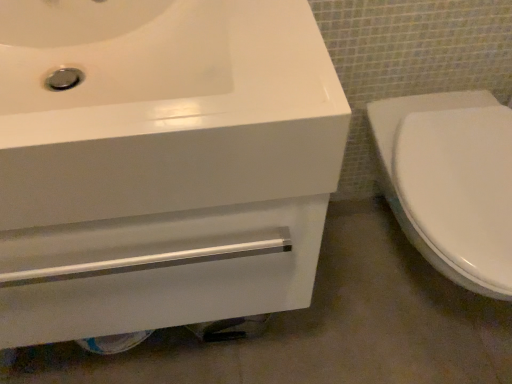
Question: From the image's perspective, is white glossy sink at upper left located above white glossy drawer at lower left?

Choices:
 (A) no
 (B) yes

Answer: (B)

Question: Does white glossy sink at upper left touch white glossy drawer at lower left?

Choices:
 (A) yes
 (B) no

Answer: (A)

Question: Can you confirm if white glossy sink at upper left is wider than white glossy drawer at lower left?

Choices:
 (A) no
 (B) yes

Answer: (A)

Question: Does white glossy sink at upper left have a greater height compared to white glossy drawer at lower left?

Choices:
 (A) yes
 (B) no

Answer: (A)

Question: Does white glossy sink at upper left appear on the left side of white glossy drawer at lower left?

Choices:
 (A) no
 (B) yes

Answer: (B)

Question: Can you confirm if white glossy sink at upper left is bigger than white glossy drawer at lower left?

Choices:
 (A) yes
 (B) no

Answer: (A)

Question: Considering the relative sizes of white glossy drawer at lower left and white glossy sink at upper left in the image provided, is white glossy drawer at lower left thinner than white glossy sink at upper left?

Choices:
 (A) yes
 (B) no

Answer: (B)

Question: Does white glossy drawer at lower left touch white glossy sink at upper left?

Choices:
 (A) yes
 (B) no

Answer: (A)

Question: From a real-world perspective, is white glossy drawer at lower left positioned under white glossy sink at upper left based on gravity?

Choices:
 (A) yes
 (B) no

Answer: (A)

Question: Is white glossy drawer at lower left positioned with its back to white glossy sink at upper left?

Choices:
 (A) no
 (B) yes

Answer: (A)

Question: Does white glossy drawer at lower left lie behind white glossy sink at upper left?

Choices:
 (A) no
 (B) yes

Answer: (B)

Question: Does white glossy drawer at lower left have a lesser height compared to white glossy sink at upper left?

Choices:
 (A) yes
 (B) no

Answer: (A)

Question: Is white glossy toilet at right positioned with its back to white glossy drawer at lower left?

Choices:
 (A) yes
 (B) no

Answer: (B)